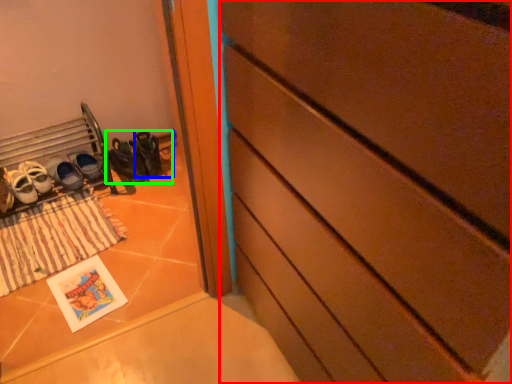
Question: Based on their relative distances, which object is farther from chest of drawers (highlighted by a red box)? Choose from shoe (highlighted by a blue box) and footwear (highlighted by a green box).

Choices:
 (A) shoe
 (B) footwear

Answer: (A)